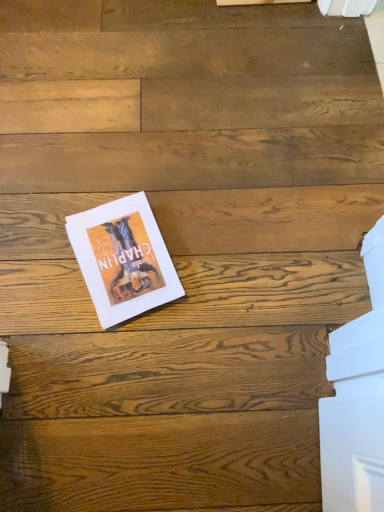
In order to click on free location in front of white paper book at center in this screenshot , I will do `click(107, 332)`.